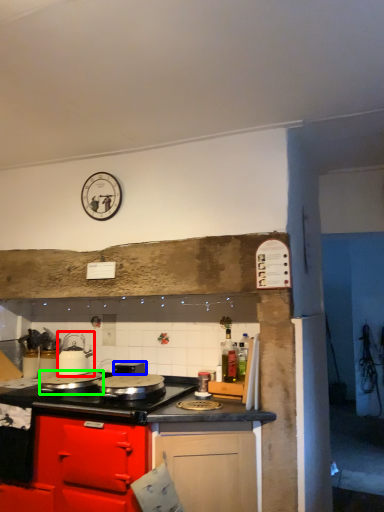
Question: Considering the real-world distances, which object is closest to kitchen appliance (highlighted by a red box)? appliance (highlighted by a blue box) or kitchen appliance (highlighted by a green box).

Choices:
 (A) appliance
 (B) kitchen appliance

Answer: (B)